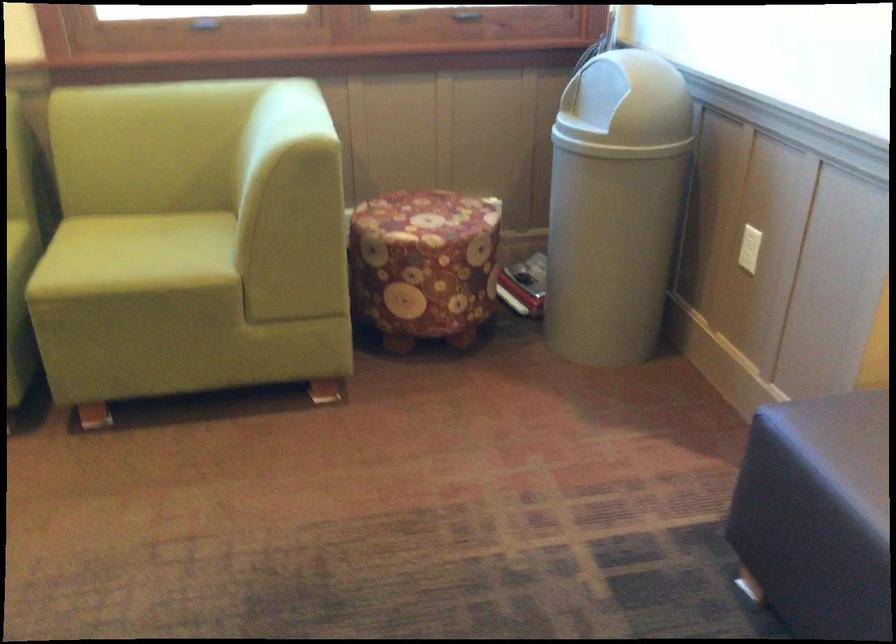
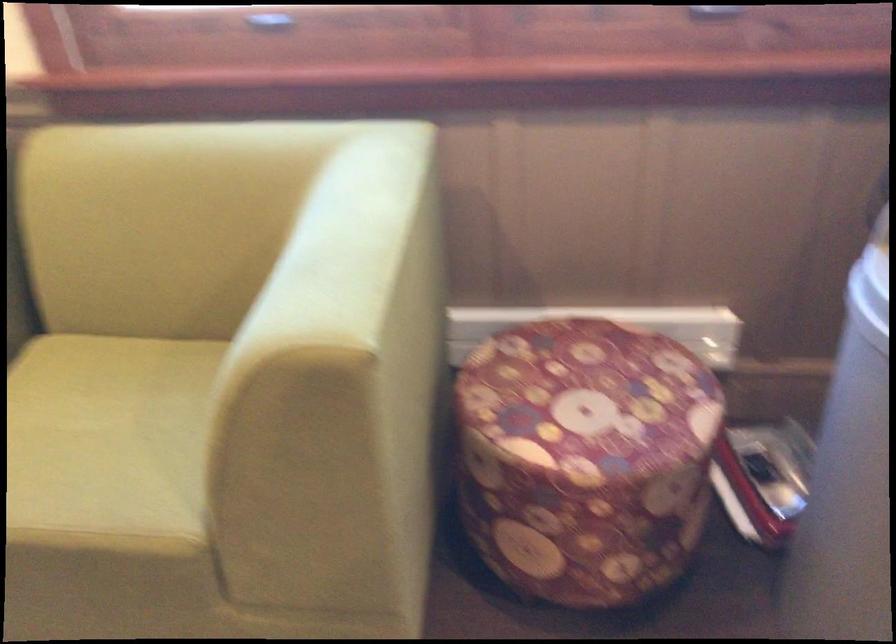
In the second image, find the point that corresponds to point (297, 109) in the first image.

(358, 223)